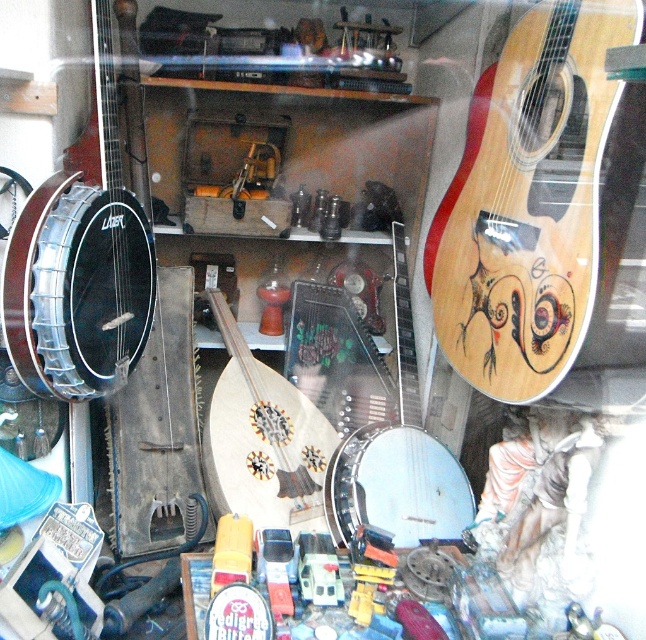
Question: Which of the following is the farthest from the observer?

Choices:
 (A) wooden acoustic guitar at upper right
 (B) matte black banjo at left
 (C) wooden mandolin at center
 (D) white matte banjo at center

Answer: (C)

Question: Is the position of wooden acoustic guitar at upper right less distant than that of white matte banjo at center?

Choices:
 (A) no
 (B) yes

Answer: (B)

Question: Which object is positioned closest to the white matte banjo at center?

Choices:
 (A) wooden mandolin at center
 (B) matte black banjo at left

Answer: (A)

Question: Is matte black banjo at left bigger than wooden mandolin at center?

Choices:
 (A) no
 (B) yes

Answer: (A)

Question: Which object is the farthest from the matte black banjo at left?

Choices:
 (A) white matte banjo at center
 (B) wooden acoustic guitar at upper right

Answer: (B)

Question: Is the position of wooden acoustic guitar at upper right less distant than that of wooden mandolin at center?

Choices:
 (A) no
 (B) yes

Answer: (B)